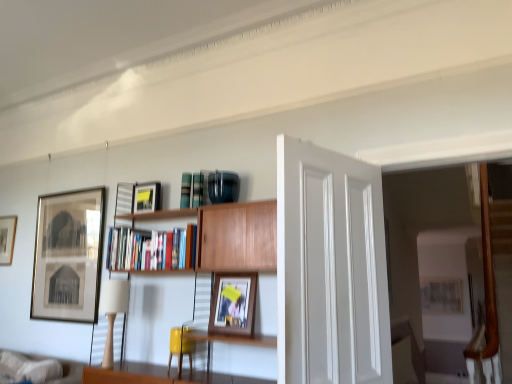
Question: Is beige fabric lampshade at left oriented towards wooden framed photo at center, positioned as the 4th picture frame in back-to-front order?

Choices:
 (A) yes
 (B) no

Answer: (B)

Question: Can you confirm if beige fabric lampshade at left is taller than wooden framed photo at center, positioned as the 4th picture frame in back-to-front order?

Choices:
 (A) yes
 (B) no

Answer: (A)

Question: Is beige fabric lampshade at left in front of wooden framed photo at center, the 4th picture frame in the left-to-right sequence?

Choices:
 (A) no
 (B) yes

Answer: (A)

Question: Is beige fabric lampshade at left at the right side of wooden framed photo at center, positioned as the 4th picture frame in back-to-front order?

Choices:
 (A) yes
 (B) no

Answer: (B)

Question: Is beige fabric lampshade at left outside of wooden framed photo at center, the 4th picture frame in the left-to-right sequence?

Choices:
 (A) yes
 (B) no

Answer: (A)

Question: Is matte black picture frame at upper center, marked as the third picture frame in a left-to-right arrangement, situated inside matte yellow swivel chair at center or outside?

Choices:
 (A) outside
 (B) inside

Answer: (A)

Question: Is matte black picture frame at upper center, the second picture frame from the front, in front of or behind matte yellow swivel chair at center in the image?

Choices:
 (A) behind
 (B) front

Answer: (A)

Question: Is matte black picture frame at upper center, marked as the third picture frame in a left-to-right arrangement, to the left or to the right of matte yellow swivel chair at center in the image?

Choices:
 (A) left
 (B) right

Answer: (A)

Question: Considering the positions of matte black picture frame at upper center, which is counted as the 2th picture frame, starting from the right, and matte yellow swivel chair at center in the image, is matte black picture frame at upper center, which is counted as the 2th picture frame, starting from the right, taller or shorter than matte yellow swivel chair at center?

Choices:
 (A) short
 (B) tall

Answer: (B)

Question: From the image's perspective, relative to wooden bookcase at center, is white smooth door at center above or below?

Choices:
 (A) above
 (B) below

Answer: (A)

Question: Considering the relative positions of white smooth door at center and wooden bookcase at center in the image provided, is white smooth door at center to the left or to the right of wooden bookcase at center?

Choices:
 (A) left
 (B) right

Answer: (B)

Question: Based on their sizes in the image, would you say white smooth door at center is bigger or smaller than wooden bookcase at center?

Choices:
 (A) big
 (B) small

Answer: (B)

Question: Choose the correct answer: Is white smooth door at center inside wooden bookcase at center or outside it?

Choices:
 (A) inside
 (B) outside

Answer: (B)

Question: Is matte black picture frame at left, arranged as the 4th picture frame when viewed from the front, spatially inside white smooth door at center, or outside of it?

Choices:
 (A) inside
 (B) outside

Answer: (B)

Question: Is matte black picture frame at left, arranged as the 4th picture frame when viewed from the front, in front of or behind white smooth door at center in the image?

Choices:
 (A) front
 (B) behind

Answer: (B)